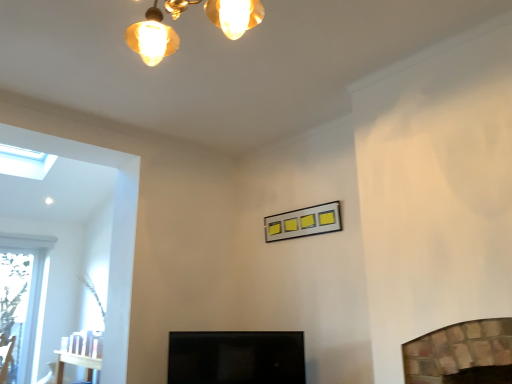
Question: From the image's perspective, would you say metallic silver picture frame at center is positioned over transparent glass skylight at upper left?

Choices:
 (A) yes
 (B) no

Answer: (B)

Question: Is metallic silver picture frame at center touching transparent glass skylight at upper left?

Choices:
 (A) no
 (B) yes

Answer: (A)

Question: Is metallic silver picture frame at center facing away from transparent glass skylight at upper left?

Choices:
 (A) yes
 (B) no

Answer: (B)

Question: Can you confirm if metallic silver picture frame at center is thinner than transparent glass skylight at upper left?

Choices:
 (A) yes
 (B) no

Answer: (A)

Question: Does metallic silver picture frame at center have a greater width compared to transparent glass skylight at upper left?

Choices:
 (A) no
 (B) yes

Answer: (A)

Question: Is metallic silver picture frame at center to the left of transparent glass skylight at upper left from the viewer's perspective?

Choices:
 (A) no
 (B) yes

Answer: (A)

Question: Can you confirm if transparent glass skylight at upper left is positioned to the right of metallic silver picture frame at center?

Choices:
 (A) yes
 (B) no

Answer: (B)

Question: Is transparent glass skylight at upper left to the left of metallic silver picture frame at center from the viewer's perspective?

Choices:
 (A) no
 (B) yes

Answer: (B)

Question: From a real-world perspective, is transparent glass skylight at upper left on top of metallic silver picture frame at center?

Choices:
 (A) no
 (B) yes

Answer: (B)

Question: Is transparent glass skylight at upper left wider than metallic silver picture frame at center?

Choices:
 (A) yes
 (B) no

Answer: (A)

Question: Can you confirm if transparent glass skylight at upper left is taller than metallic silver picture frame at center?

Choices:
 (A) yes
 (B) no

Answer: (A)

Question: Does transparent glass skylight at upper left have a smaller size compared to metallic silver picture frame at center?

Choices:
 (A) yes
 (B) no

Answer: (B)

Question: Can you confirm if black glossy screen door at center is smaller than metallic silver picture frame at center?

Choices:
 (A) yes
 (B) no

Answer: (B)